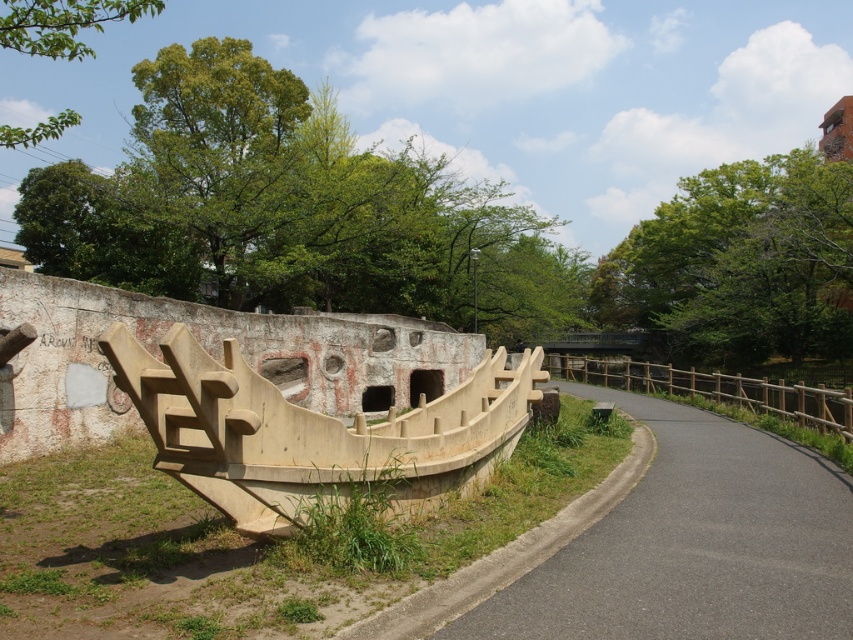
Question: Is asphalt road at center positioned before beige concrete boat at center?

Choices:
 (A) no
 (B) yes

Answer: (B)

Question: Which object appears closest to the camera in this image?

Choices:
 (A) asphalt road at center
 (B) beige concrete boat at center

Answer: (A)

Question: Can you confirm if asphalt road at center is thinner than beige concrete boat at center?

Choices:
 (A) no
 (B) yes

Answer: (A)

Question: Does asphalt road at center have a larger size compared to beige concrete boat at center?

Choices:
 (A) no
 (B) yes

Answer: (B)